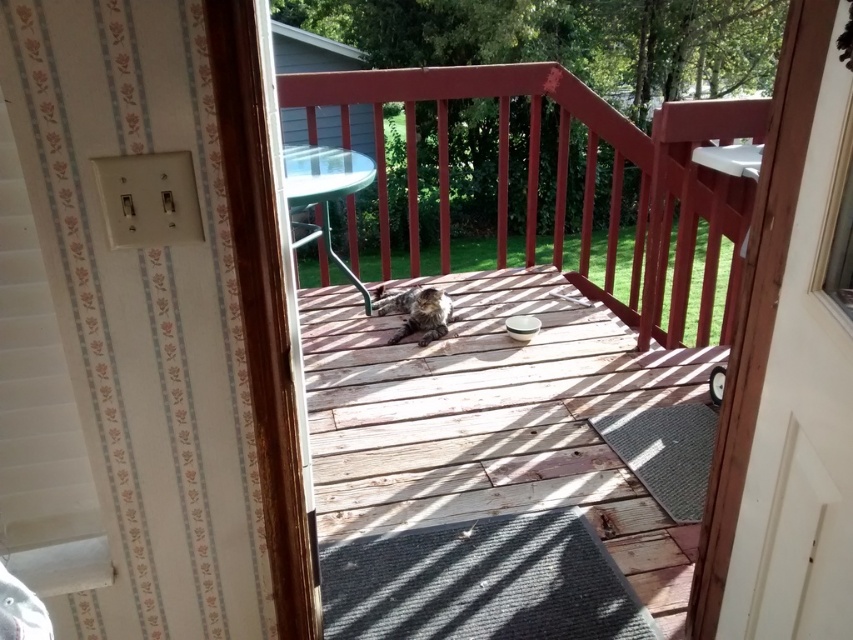
You are standing inside the house near the dark gray mat and want to reach the fuzzy brown cat at center on the wooden deck at center. Which object is closer to you as you approach the cat?

Result: The wooden deck at center is closer to the viewer than the fuzzy brown cat at center, so you would first step onto the wooden deck at center before reaching the cat.

You are standing at the entrance of the deck and want to reach the point marked as point (502,321). Is this point closer to you than the point marked as point (589,128)?

Yes, the point (502,321) is closer to you than the point (589,128) because it is in front of it.